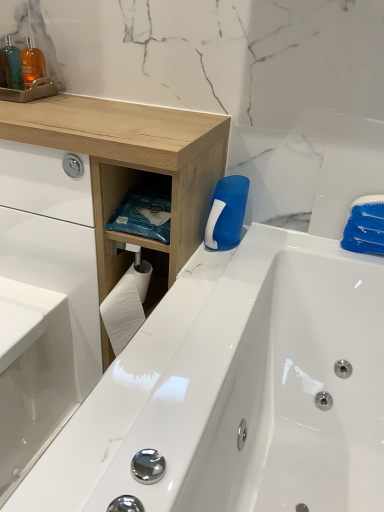
Question: Is white glossy sink at lower left outside of translucent plastic bottle at upper left?

Choices:
 (A) yes
 (B) no

Answer: (A)

Question: From the image's perspective, would you say white glossy sink at lower left is positioned over translucent plastic bottle at upper left?

Choices:
 (A) yes
 (B) no

Answer: (B)

Question: Does white glossy sink at lower left have a greater width compared to translucent plastic bottle at upper left?

Choices:
 (A) yes
 (B) no

Answer: (A)

Question: Considering the relative sizes of white glossy sink at lower left and translucent plastic bottle at upper left in the image provided, is white glossy sink at lower left bigger than translucent plastic bottle at upper left?

Choices:
 (A) yes
 (B) no

Answer: (A)

Question: Is translucent plastic bottle at upper left surrounded by white glossy sink at lower left?

Choices:
 (A) yes
 (B) no

Answer: (B)

Question: In terms of width, does natural wood counter at upper left look wider or thinner when compared to white glossy sink at lower left?

Choices:
 (A) wide
 (B) thin

Answer: (B)

Question: From the image's perspective, is natural wood counter at upper left located above or below white glossy sink at lower left?

Choices:
 (A) above
 (B) below

Answer: (A)

Question: Do you think natural wood counter at upper left is within white glossy sink at lower left, or outside of it?

Choices:
 (A) inside
 (B) outside

Answer: (B)

Question: Looking at the image, does natural wood counter at upper left seem bigger or smaller compared to white glossy sink at lower left?

Choices:
 (A) big
 (B) small

Answer: (A)

Question: From the image's perspective, is blue plastic cleaning brush at upper right located above or below natural wood counter at upper left?

Choices:
 (A) above
 (B) below

Answer: (A)

Question: Considering the positions of blue plastic cleaning brush at upper right and natural wood counter at upper left in the image, is blue plastic cleaning brush at upper right bigger or smaller than natural wood counter at upper left?

Choices:
 (A) big
 (B) small

Answer: (B)

Question: From their relative heights in the image, would you say blue plastic cleaning brush at upper right is taller or shorter than natural wood counter at upper left?

Choices:
 (A) short
 (B) tall

Answer: (A)

Question: Considering their positions, is blue plastic cleaning brush at upper right located in front of or behind natural wood counter at upper left?

Choices:
 (A) front
 (B) behind

Answer: (B)

Question: From a real-world perspective, is translucent plastic bottle at upper left above or below white glossy sink at lower left?

Choices:
 (A) above
 (B) below

Answer: (A)

Question: Is point (11, 74) positioned closer to the camera than point (14, 287)?

Choices:
 (A) farther
 (B) closer

Answer: (B)